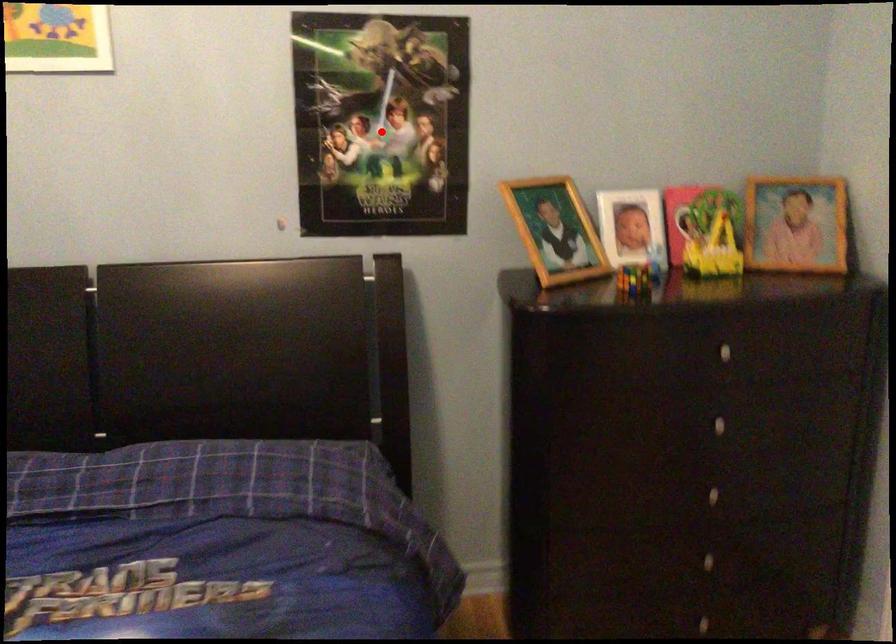
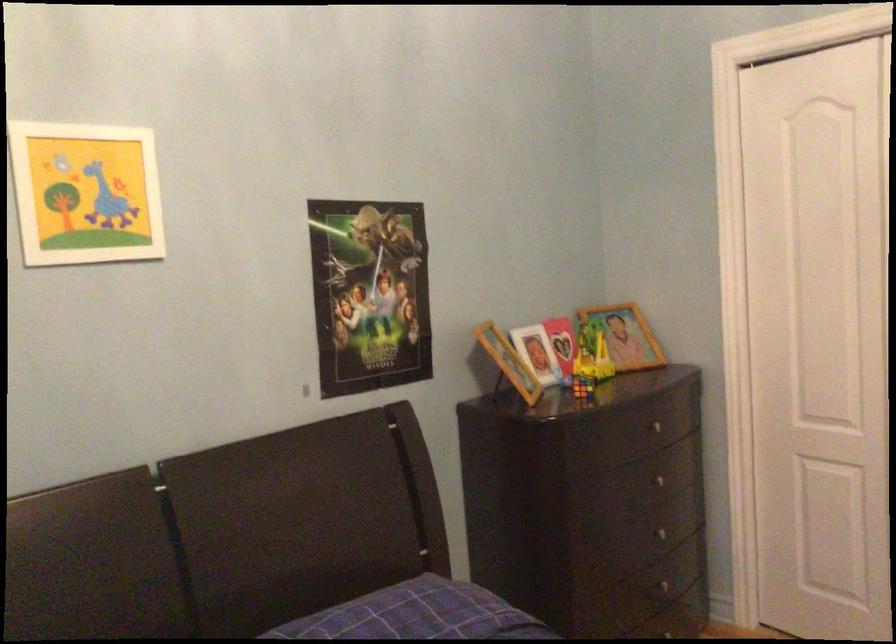
Question: I am providing you with two images of the same scene from different viewpoints. A red point is shown in image1. For the corresponding object point in image2, is it positioned nearer or farther from the camera?

Choices:
 (A) Nearer
 (B) Farther

Answer: (B)